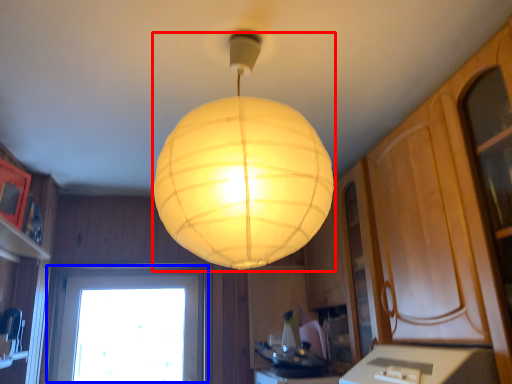
Question: Among these objects, which one is nearest to the camera, lamp (highlighted by a red box) or window (highlighted by a blue box)?

Choices:
 (A) lamp
 (B) window

Answer: (A)